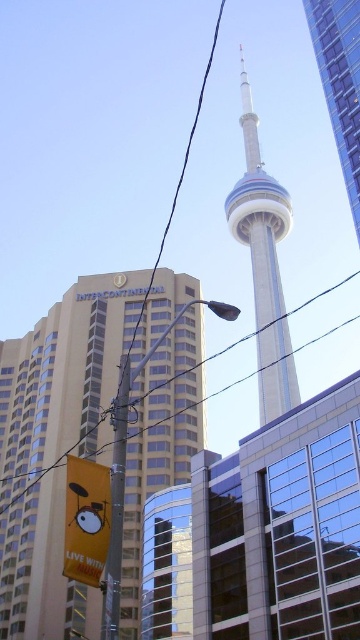
You are a drone operator who needs to fly a drone from the beige glass building at center to the black wire at upper center. The drone has a maximum flight distance of 50 feet. Can the drone make this flight without needing to recharge?

The distance between the beige glass building at center and the black wire at upper center is 60.39 feet, which exceeds the drone maximum flight distance of 50 feet. The drone cannot make this flight without needing to recharge.

In the scene shown: You are standing in front of the CN Tower and want to locate the point at coordinates (65, 376). Based on the scene description, which structure should you look at to find this point?

The point at coordinates (65, 376) is located on the beige glass building at center, so you should look at the beige glass building at center to find this point.

Based on the photo, you are standing at the base of the CN Tower in Toronto and want to take a photo of the bright yellow banner with the cartoon drum set. The banner is located at point (137, 385). If your camera has a maximum zoom range of 100 meters, will you be able to capture the banner clearly?

The point (137, 385) is 89.22 meters away from the viewer. Since the camera can zoom up to 100 meters, the banner can be captured clearly within the maximum range.